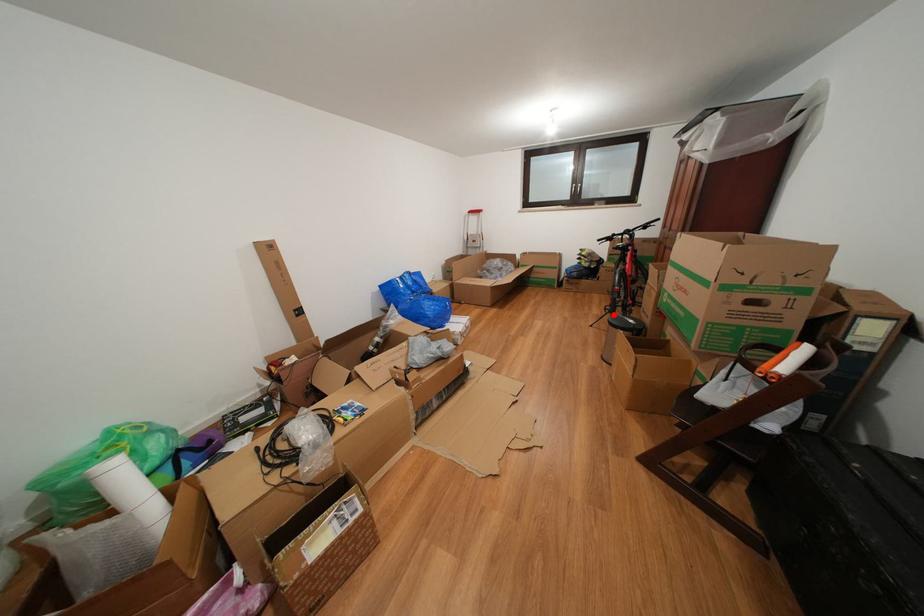
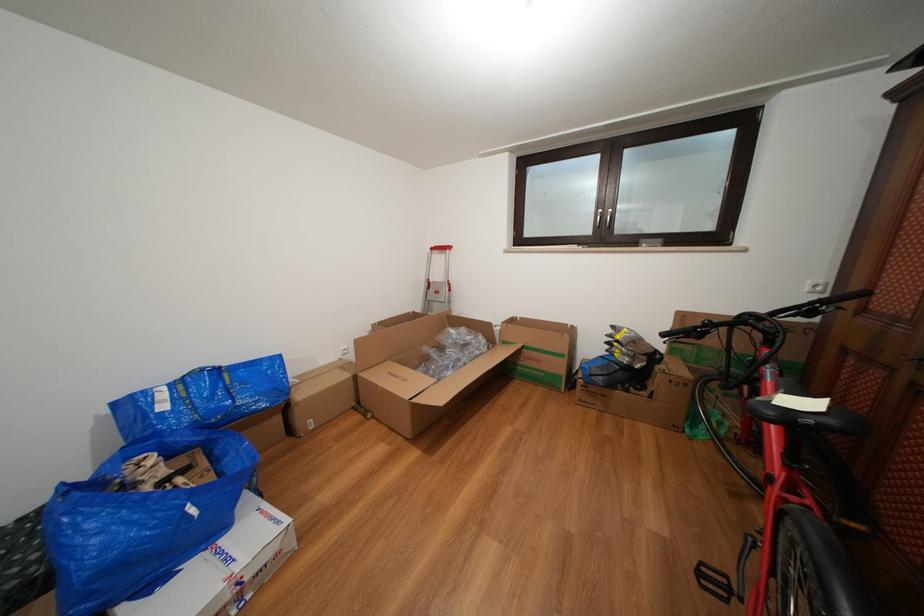
Find the pixel in the second image that matches the highlighted location in the first image.

(708, 578)